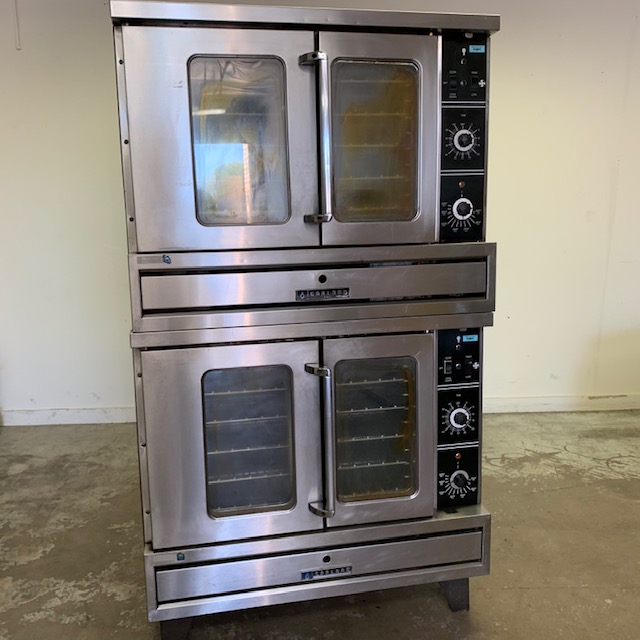
I want to click on windows, so click(243, 444), click(368, 428), click(236, 116), click(372, 125).